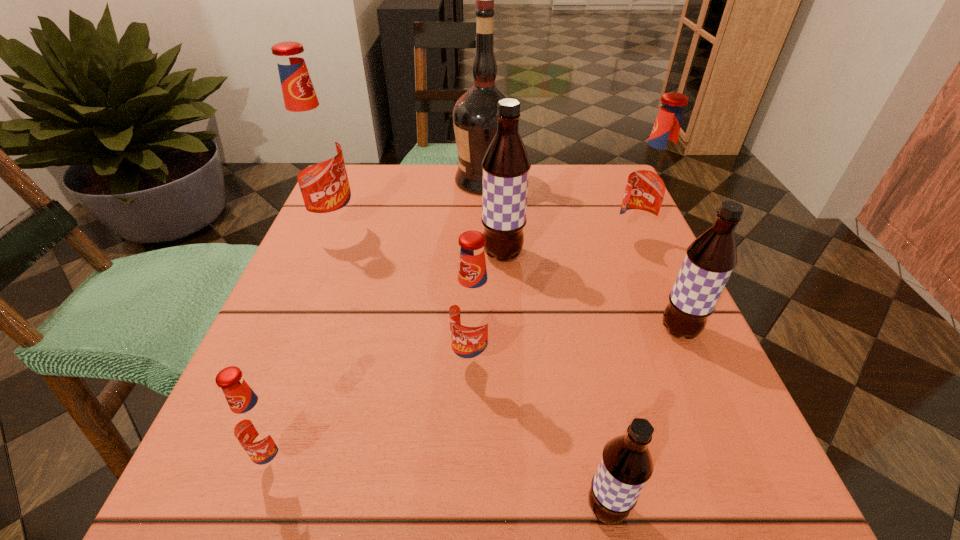
The width and height of the screenshot is (960, 540). In the image, there is a desktop. In order to click on free space at the right edge in this screenshot , I will do `click(667, 335)`.

Find the location of a particular element. vacant area at the far left corner is located at coordinates (405, 166).

Locate an element on the screen. This screenshot has height=540, width=960. vacant space at the far right corner is located at coordinates (574, 194).

Where is `vacant area between the farthest brown root beer and the third object from right to left`? The image size is (960, 540). vacant area between the farthest brown root beer and the third object from right to left is located at coordinates (554, 381).

Where is `free space between the third object from right to left and the leftmost brown root beer`? This screenshot has height=540, width=960. free space between the third object from right to left and the leftmost brown root beer is located at coordinates (554, 381).

You are a GUI agent. You are given a task and a screenshot of the screen. Output one action in this format:
    pyautogui.click(x=<x>, y=<y>)
    Task: Click on the empty space between the rightmost red root beer and the farthest object
    
    Given the screenshot: What is the action you would take?
    pyautogui.click(x=559, y=213)

Locate an element on the screen. free space between the third smallest red root beer and the farthest brown root beer is located at coordinates (568, 250).

Find the location of a particular element. empty space that is in between the third farthest red root beer and the third object from right to left is located at coordinates (540, 435).

Find the location of a particular element. This screenshot has height=540, width=960. free space between the second nearest object and the rightmost brown root beer is located at coordinates (479, 395).

What are the coordinates of `the second closest object relative to the smallest red root beer` in the screenshot? It's located at (626, 464).